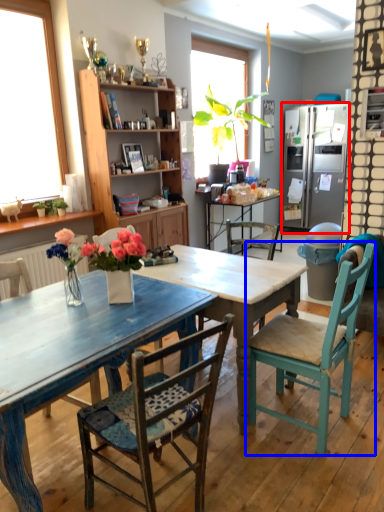
Question: Which point is closer to the camera, refrigerator (highlighted by a red box) or chair (highlighted by a blue box)?

Choices:
 (A) refrigerator
 (B) chair

Answer: (B)